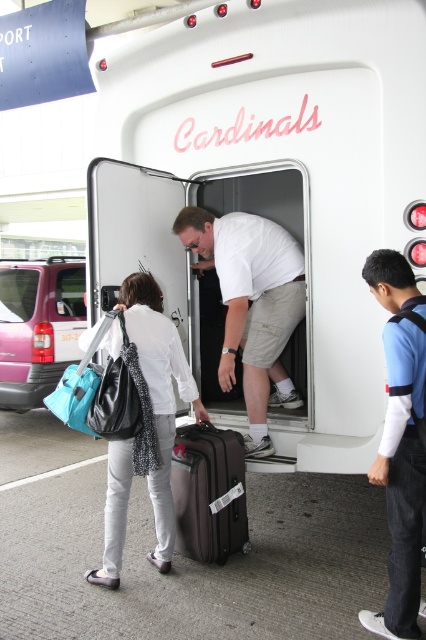
You are a traveler at the airport and have to choose between the blue fabric backpack at center right and the matte black bag at left. Which one is smaller?

The blue fabric backpack at center right is smaller than the matte black bag at left.

You are a passenger at the airport and see the white matte shirt at center and the matte pink van at left. Which object is taller?

The matte pink van at left is taller than the white matte shirt at center.

Based on the scene description, can you determine the exact coordinates of the white matte shirt at center?

The white matte shirt at center is located at coordinates point (252, 305).